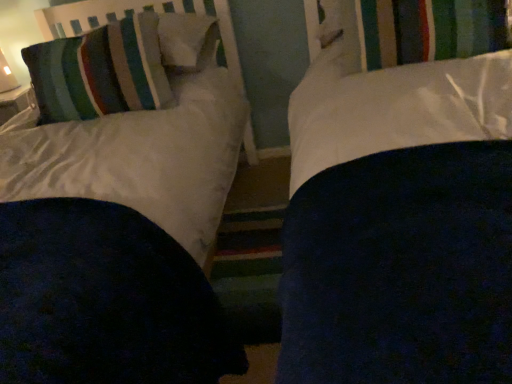
Question: Would you say striped fabric pillow at upper left is to the left or to the right of striped fabric headboard at upper left in the picture?

Choices:
 (A) left
 (B) right

Answer: (A)

Question: Considering their positions, is striped fabric pillow at upper left located in front of or behind striped fabric headboard at upper left?

Choices:
 (A) behind
 (B) front

Answer: (B)

Question: Which object is the closest to the striped fabric curtain at upper center?

Choices:
 (A) striped fabric pillow at upper left
 (B) striped fabric headboard at upper left

Answer: (A)

Question: Which is farther from the striped fabric headboard at upper left?

Choices:
 (A) striped fabric pillow at upper left
 (B) striped fabric curtain at upper center

Answer: (B)